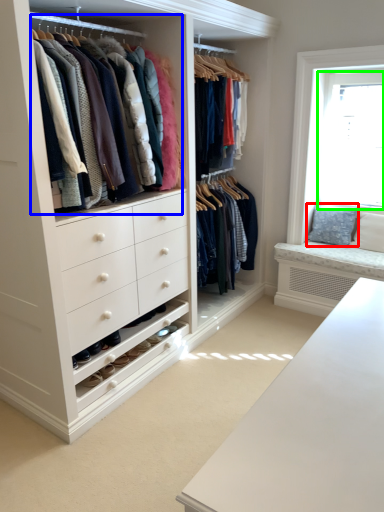
Question: Based on their relative distances, which object is nearer to pillow (highlighted by a red box)? Choose from closet (highlighted by a blue box) and bay window (highlighted by a green box).

Choices:
 (A) closet
 (B) bay window

Answer: (B)